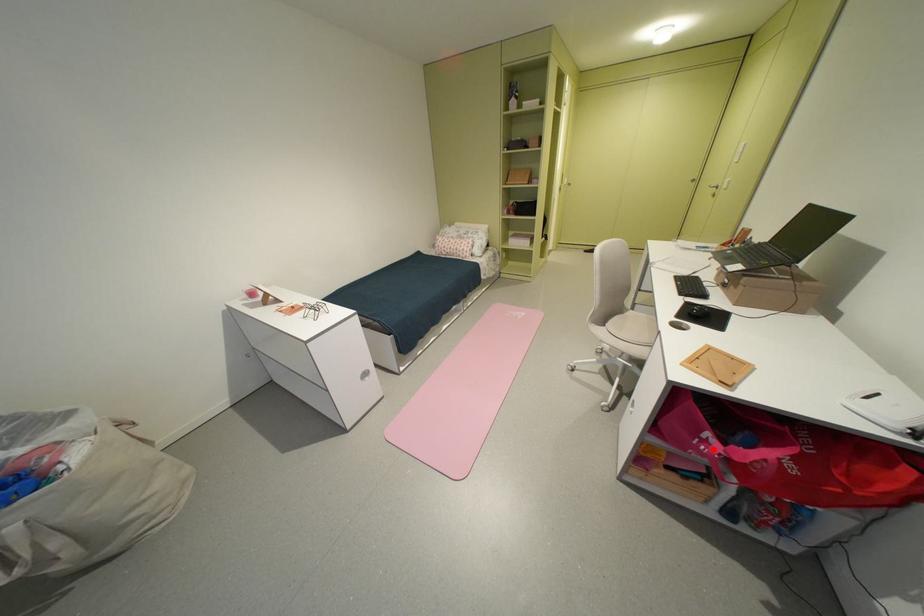
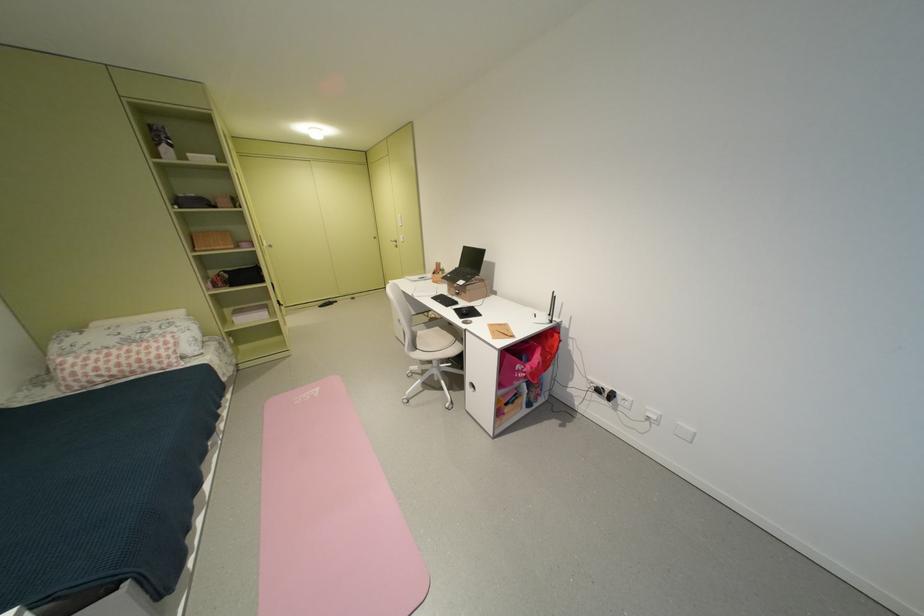
Where in the second image is the point corresponding to the highlighted location from the first image?

(530, 376)